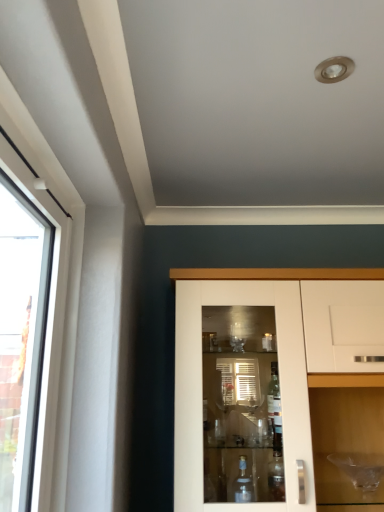
This screenshot has width=384, height=512. What do you see at coordinates (50, 291) in the screenshot?
I see `white plastic window at left` at bounding box center [50, 291].

Image resolution: width=384 pixels, height=512 pixels. I want to click on white plastic window at left, so click(50, 291).

Find the location of a particular element. This screenshot has height=512, width=384. white plastic window at left is located at coordinates (50, 291).